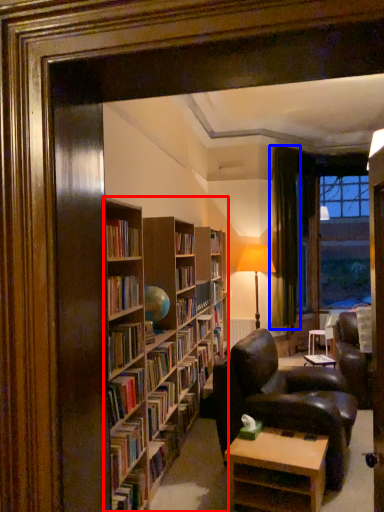
Question: Among these objects, which one is nearest to the camera, bookcase (highlighted by a red box) or curtain (highlighted by a blue box)?

Choices:
 (A) bookcase
 (B) curtain

Answer: (A)